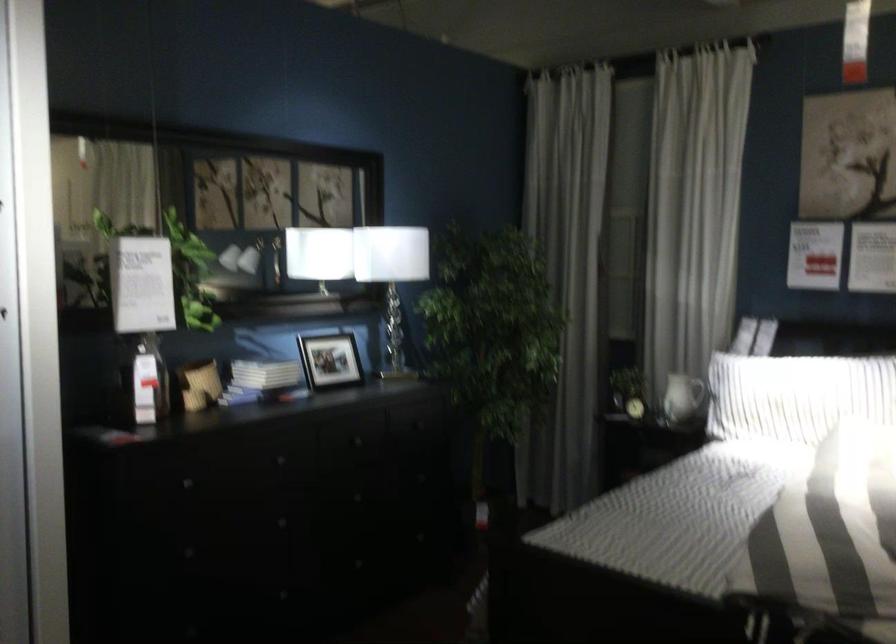
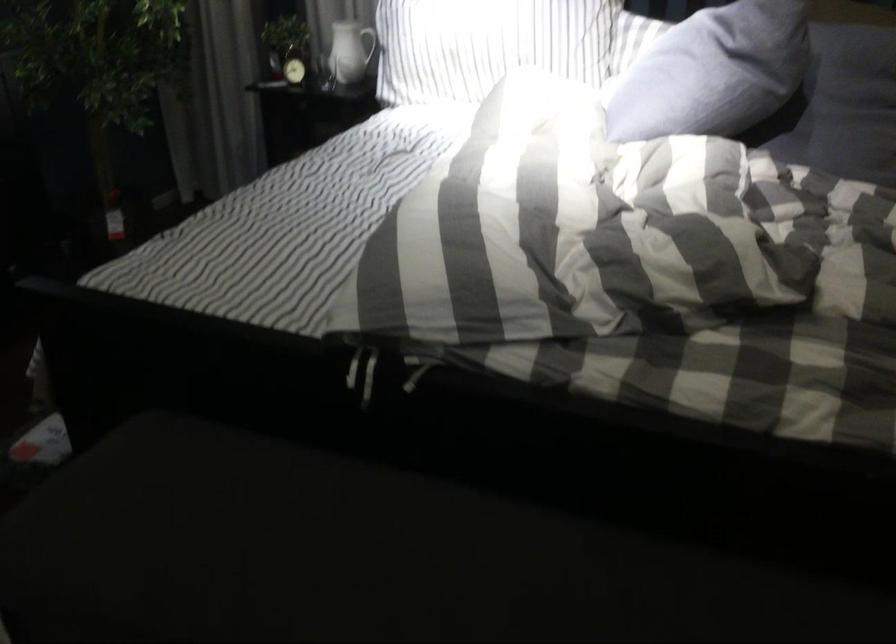
Locate, in the second image, the point that corresponds to point 643,395 in the first image.

(294, 62)